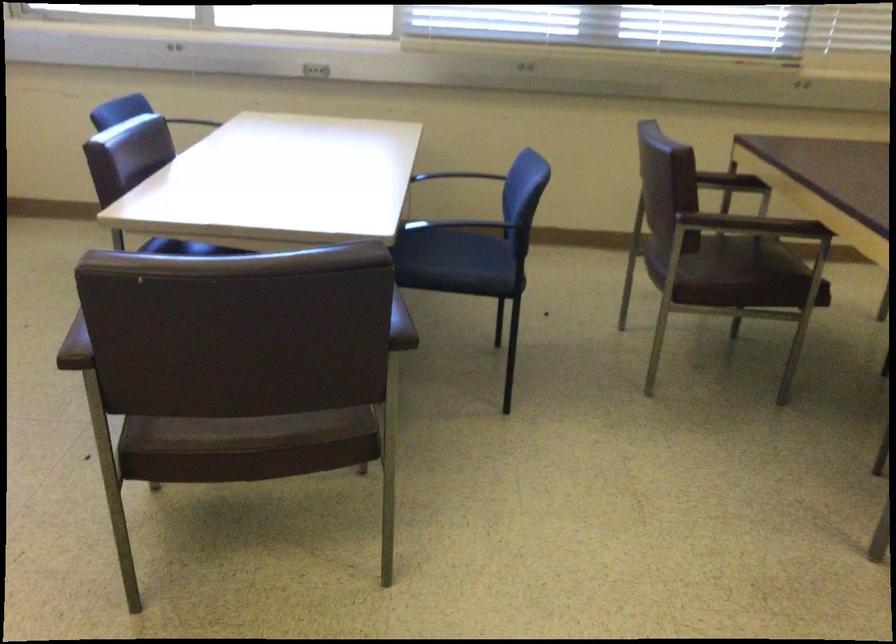
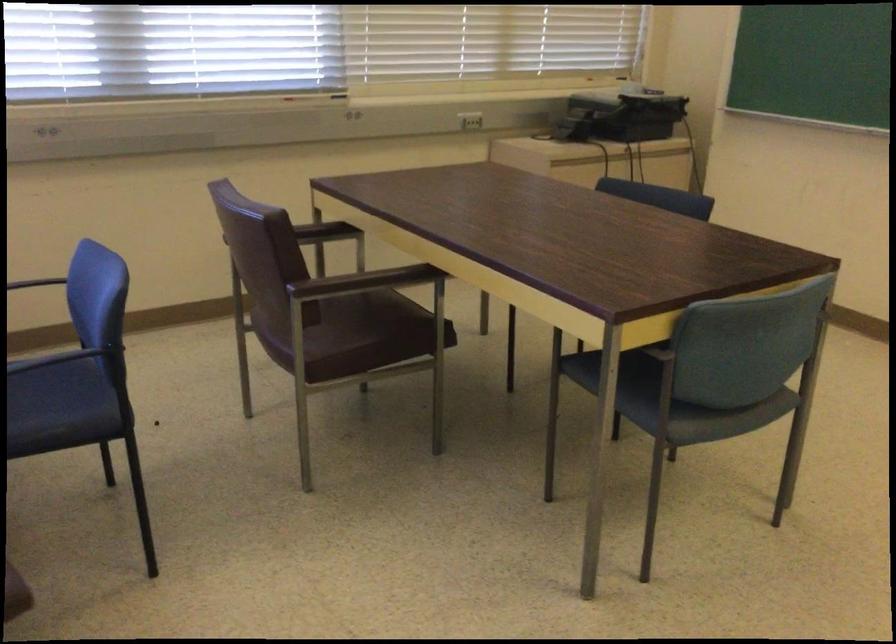
Find the pixel in the second image that matches (x=733, y=178) in the first image.

(323, 232)